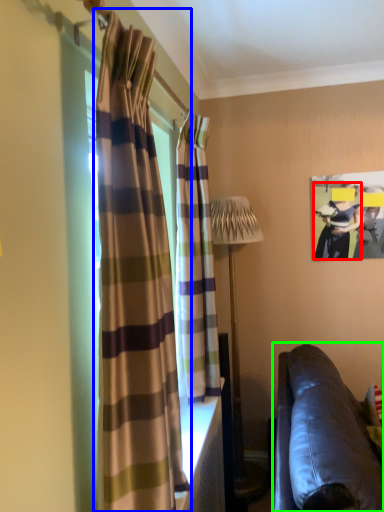
Question: Considering the real-world distances, which object is closest to person (highlighted by a red box)? curtain (highlighted by a blue box) or studio couch (highlighted by a green box).

Choices:
 (A) curtain
 (B) studio couch

Answer: (B)